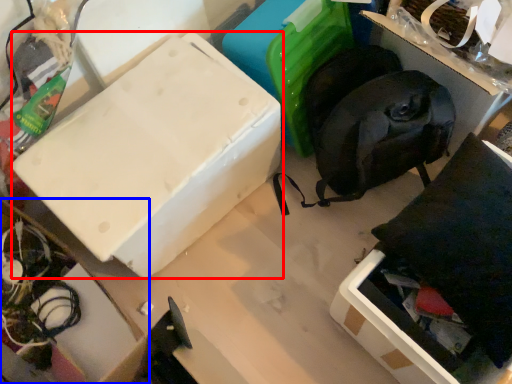
Question: Which point is further to the camera, box (highlighted by a red box) or cardboard box (highlighted by a blue box)?

Choices:
 (A) box
 (B) cardboard box

Answer: (A)